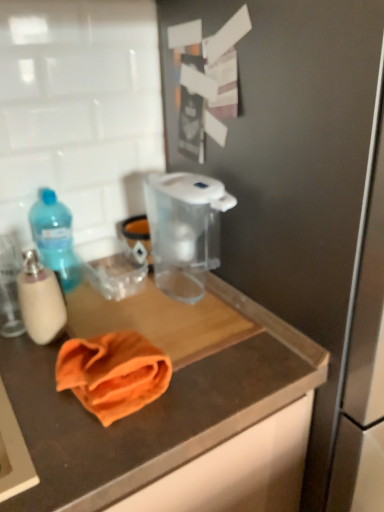
Question: Is the depth of transparent plastic pitcher at center less than that of blue translucent bottle at left, the first bottle when ordered from back to front?

Choices:
 (A) no
 (B) yes

Answer: (B)

Question: Is transparent plastic pitcher at center not within blue translucent bottle at left, the first bottle when ordered from back to front?

Choices:
 (A) yes
 (B) no

Answer: (A)

Question: From the image's perspective, is transparent plastic pitcher at center under blue translucent bottle at left, which is the 2th bottle in front-to-back order?

Choices:
 (A) yes
 (B) no

Answer: (B)

Question: Would you say transparent plastic pitcher at center is a long distance from blue translucent bottle at left, the first bottle when ordered from back to front?

Choices:
 (A) no
 (B) yes

Answer: (A)

Question: From a real-world perspective, is transparent plastic pitcher at center located higher than blue translucent bottle at left, which is the 2th bottle in front-to-back order?

Choices:
 (A) yes
 (B) no

Answer: (A)

Question: In the image, is blue translucent bottle at left, the first bottle when ordered from back to front, positioned in front of or behind translucent plastic soap dispenser at left, which appears as the second bottle when viewed from the back?

Choices:
 (A) front
 (B) behind

Answer: (B)

Question: Looking at the image, does blue translucent bottle at left, which is the 2th bottle in front-to-back order, seem bigger or smaller compared to translucent plastic soap dispenser at left, which appears as the second bottle when viewed from the back?

Choices:
 (A) big
 (B) small

Answer: (A)

Question: From the image's perspective, is blue translucent bottle at left, the first bottle when ordered from back to front, positioned above or below translucent plastic soap dispenser at left, which appears as the second bottle when viewed from the back?

Choices:
 (A) above
 (B) below

Answer: (A)

Question: Is blue translucent bottle at left, the first bottle when ordered from back to front, wider or thinner than translucent plastic soap dispenser at left, which appears as the second bottle when viewed from the back?

Choices:
 (A) wide
 (B) thin

Answer: (A)

Question: Is point (167, 248) positioned closer to the camera than point (69, 372)?

Choices:
 (A) closer
 (B) farther

Answer: (B)

Question: In terms of width, does transparent plastic pitcher at center look wider or thinner when compared to orange cloth at center?

Choices:
 (A) thin
 (B) wide

Answer: (B)

Question: From their relative heights in the image, would you say transparent plastic pitcher at center is taller or shorter than orange cloth at center?

Choices:
 (A) tall
 (B) short

Answer: (A)

Question: From a real-world perspective, relative to orange cloth at center, is transparent plastic pitcher at center vertically above or below?

Choices:
 (A) below
 (B) above

Answer: (B)

Question: From a real-world perspective, relative to transparent plastic pitcher at center, is blue translucent bottle at left, the first bottle when ordered from back to front, vertically above or below?

Choices:
 (A) below
 (B) above

Answer: (A)

Question: From their relative heights in the image, would you say blue translucent bottle at left, the first bottle when ordered from back to front, is taller or shorter than transparent plastic pitcher at center?

Choices:
 (A) tall
 (B) short

Answer: (B)